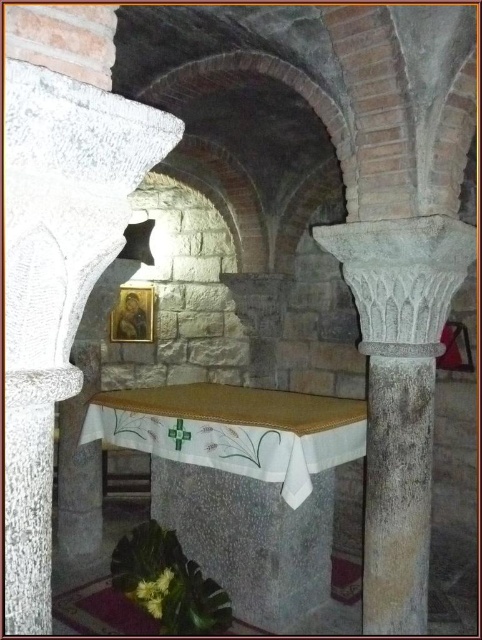
You are an architect designing a new structure and need to place a 1.5 meter wide decorative panel between the granite column at left and the gray stone column at center. Based on the spacing between them, will the panel fit without any adjustments?

The granite column at left and gray stone column at center are 1.69 meters apart from each other. Since the decorative panel is 1.5 meters wide, it will fit with some space remaining between the panel and the columns.

You are standing in front of the altar and want to place a decorative vase between the granite column at left and the gray stone column at center. Which column should you place it closer to if you want the vase to be centered between them?

To center the vase between the granite column at left and the gray stone column at center, place it closer to the gray stone column at center since the granite column at left is positioned to the left of the gray stone column at center.